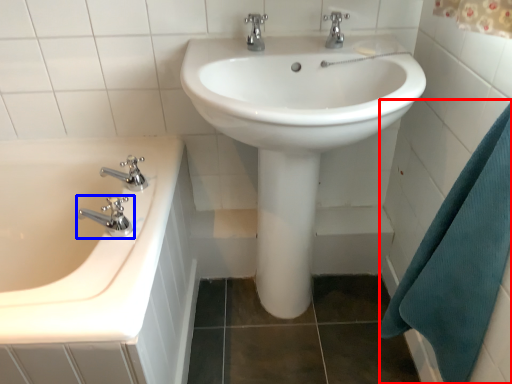
Question: Which object is further to the camera taking this photo, bath towel (highlighted by a red box) or tap (highlighted by a blue box)?

Choices:
 (A) bath towel
 (B) tap

Answer: (B)